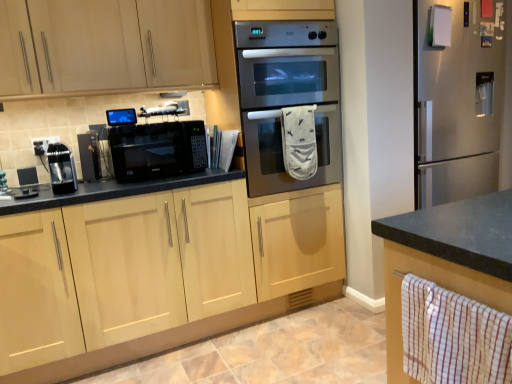
Question: Is satin black microwave at center inside the boundaries of light wood cabinet at upper left, placed as the 1th cabinetry when sorted from top to bottom, or outside?

Choices:
 (A) inside
 (B) outside

Answer: (B)

Question: From a real-world perspective, relative to light wood cabinet at upper left, which is counted as the 2th cabinetry, starting from the bottom, is satin black microwave at center vertically above or below?

Choices:
 (A) below
 (B) above

Answer: (A)

Question: Estimate the real-world distances between objects in this image. Which object is closer to the matte black microwave at center, arranged as the 1th appliance when viewed from the right?

Choices:
 (A) light wood cabinet at upper left, placed as the 1th cabinetry when sorted from top to bottom
 (B) light wood/finish cabinet at center, which is the 2th cabinetry from top to bottom
 (C) satin black microwave at center
 (D) white checkered hand towel at lower right, arranged as the 1th hand towel when viewed from the front
 (E) black matte microwave at center

Answer: (E)

Question: Which is farther from the white checkered hand towel at lower right, which is the second hand towel in back-to-front order?

Choices:
 (A) light wood cabinet at upper left, which is counted as the 2th cabinetry, starting from the bottom
 (B) black plastic electric outlet at upper left
 (C) light wood/finish cabinet at center, which is the 2th cabinetry from top to bottom
 (D) black matte coffee maker at left, the second appliance positioned from the right
 (E) black matte microwave at center

Answer: (B)